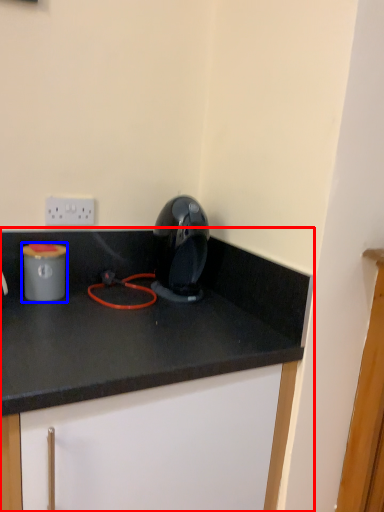
Question: Which object is closer to the camera taking this photo, cabinetry (highlighted by a red box) or appliance (highlighted by a blue box)?

Choices:
 (A) cabinetry
 (B) appliance

Answer: (A)